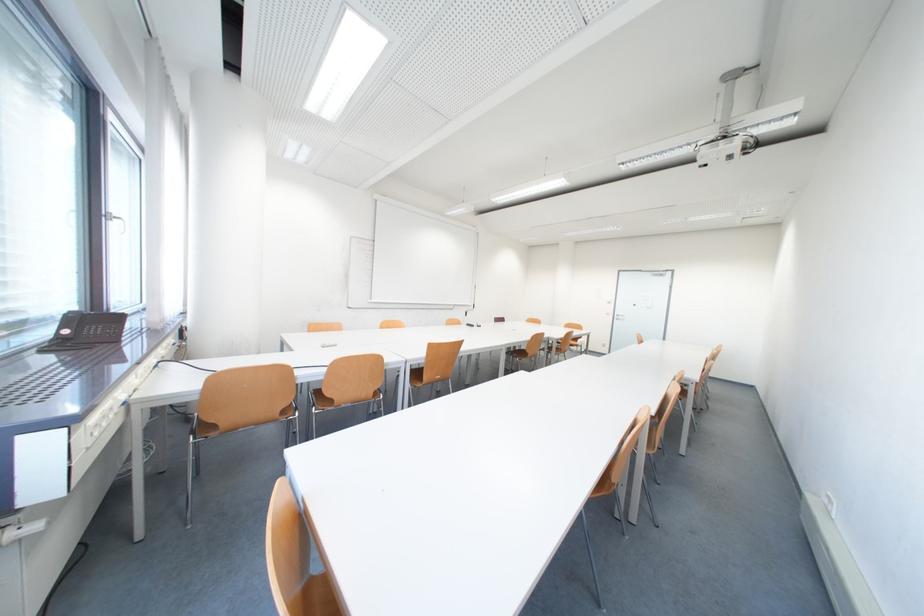
At what (x,y) coordinates should I click in order to perform the action: click on silver window handle. Please return your answer as a coordinate pair (x, y). Looking at the image, I should click on (115, 221).